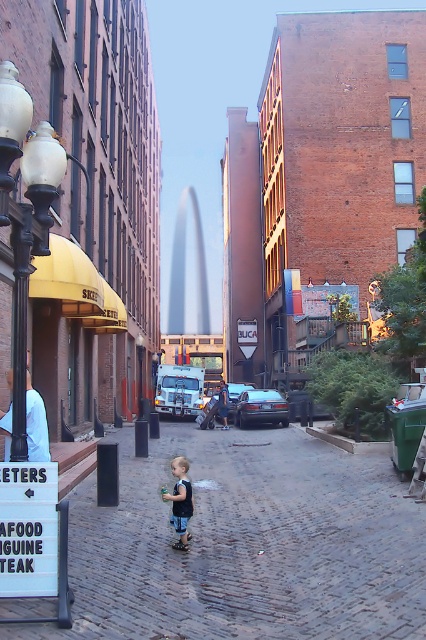
Can you confirm if black glass lamp post at left is bigger than white plastic sign at lower left?

Yes.

Is black glass lamp post at left thinner than white plastic sign at lower left?

Indeed, black glass lamp post at left has a lesser width compared to white plastic sign at lower left.

What do you see at coordinates (25, 218) in the screenshot?
I see `black glass lamp post at left` at bounding box center [25, 218].

Find the location of a particular element. black glass lamp post at left is located at coordinates (25, 218).

Can you confirm if cobblestone pavement at center is shorter than black glass lamp post at left?

Indeed, cobblestone pavement at center has a lesser height compared to black glass lamp post at left.

Between point (83, 618) and point (17, 428), which one is positioned in front?

Point (83, 618) is more forward.

The height and width of the screenshot is (640, 426). I want to click on cobblestone pavement at center, so click(x=245, y=545).

Can you confirm if cobblestone pavement at center is thinner than white plastic sign at lower left?

Incorrect, cobblestone pavement at center's width is not less than white plastic sign at lower left's.

Is point (265, 496) farther from viewer compared to point (49, 496)?

Yes, point (265, 496) is behind point (49, 496).

Who is more distant from viewer, (x=175, y=621) or (x=55, y=570)?

Positioned behind is point (x=175, y=621).

Find the location of a particular element. The height and width of the screenshot is (640, 426). cobblestone pavement at center is located at coordinates (245, 545).